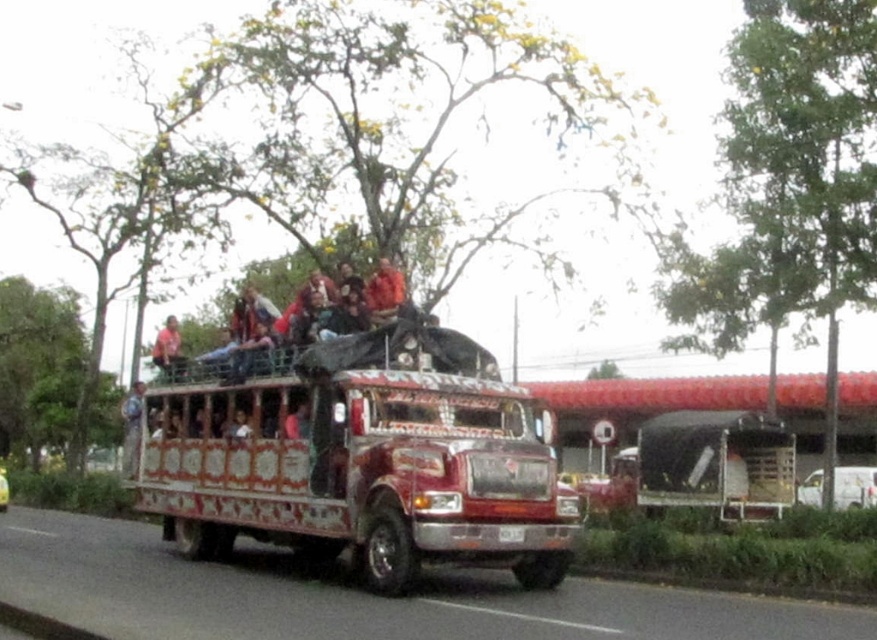
Which is above, decorative painted bus at center or matte pink shirt at center?

matte pink shirt at center is above.

Can you confirm if decorative painted bus at center is taller than matte pink shirt at center?

Incorrect, decorative painted bus at center's height is not larger of matte pink shirt at center's.

The height and width of the screenshot is (640, 877). In order to click on decorative painted bus at center in this screenshot , I will do [362, 461].

The image size is (877, 640). Identify the location of decorative painted bus at center. (362, 461).